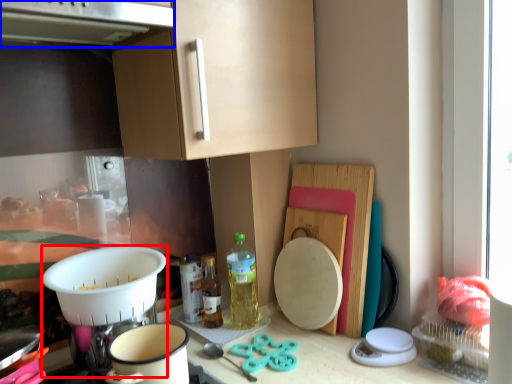
Question: Among these objects, which one is nearest to the camera, appliance (highlighted by a red box) or exhaust hood (highlighted by a blue box)?

Choices:
 (A) appliance
 (B) exhaust hood

Answer: (B)